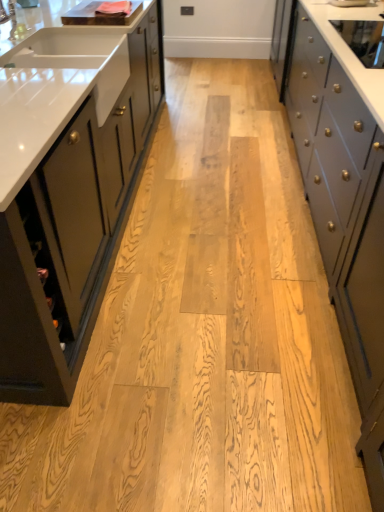
Question: Visually, is matte dark green cabinet at left, which ranks as the 1th cabinetry in left-to-right order, positioned to the left or to the right of silver metallic faucet at upper left?

Choices:
 (A) left
 (B) right

Answer: (A)

Question: In terms of size, does matte dark green cabinet at left, the second cabinetry when ordered from right to left, appear bigger or smaller than silver metallic faucet at upper left?

Choices:
 (A) big
 (B) small

Answer: (A)

Question: Which object is positioned farthest from the matte dark green cabinet at left, which ranks as the 1th cabinetry in left-to-right order?

Choices:
 (A) silver metallic faucet at upper left
 (B) gray matte cabinet at right, which appears as the first cabinetry when viewed from the right

Answer: (B)

Question: Which object is the closest to the matte dark green cabinet at left, which ranks as the 1th cabinetry in left-to-right order?

Choices:
 (A) gray matte cabinet at right, acting as the second cabinetry starting from the left
 (B) silver metallic faucet at upper left

Answer: (B)